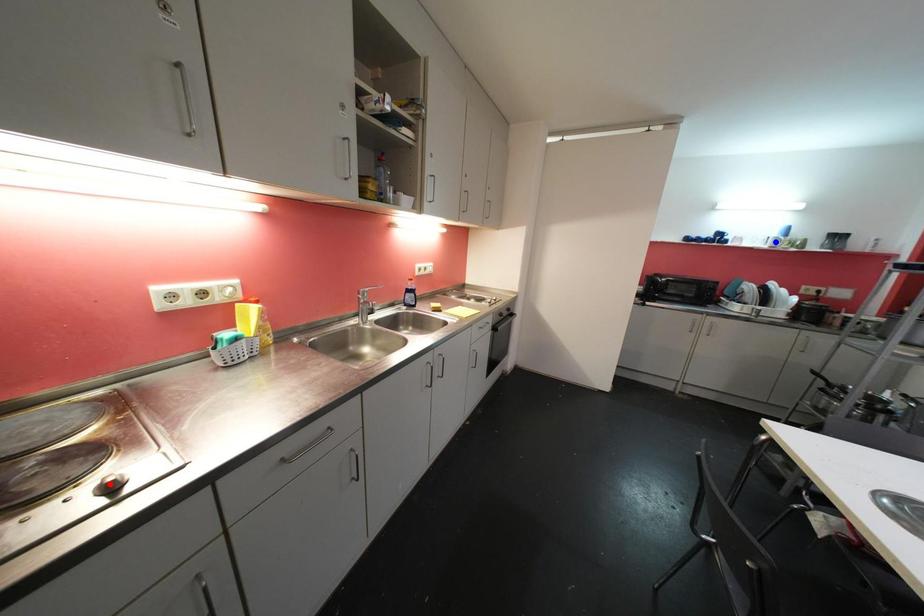
Question: In the image, two points are highlighted. Which point is nearer to the camera? Reply with the corresponding letter.

Choices:
 (A) blue point
 (B) red point

Answer: (B)